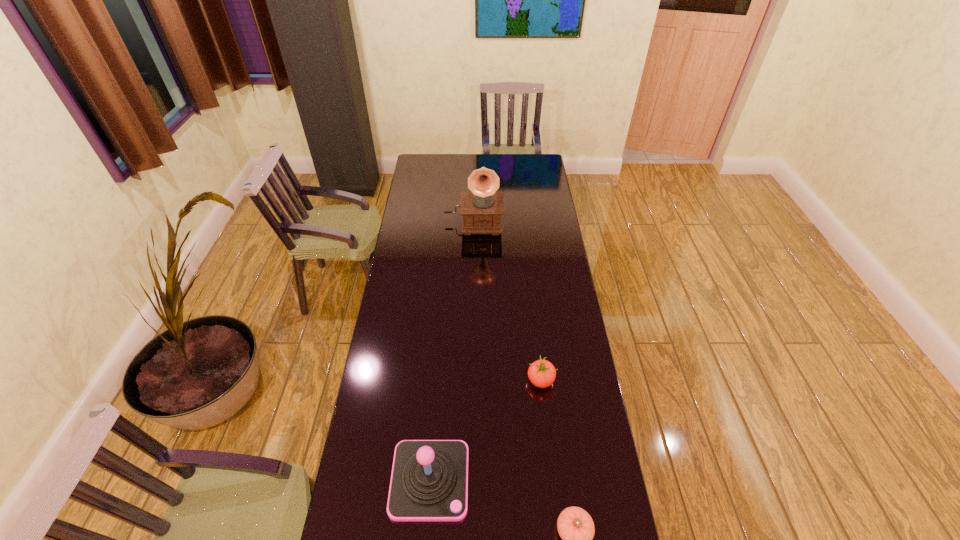
This screenshot has height=540, width=960. Find the location of `free location that satisfies the following two spatial constraints: 1. on the horn of the farther tomato; 2. on the left side of the record player`. free location that satisfies the following two spatial constraints: 1. on the horn of the farther tomato; 2. on the left side of the record player is located at coordinates (470, 381).

The height and width of the screenshot is (540, 960). Identify the location of vacant point that satisfies the following two spatial constraints: 1. on the horn of the second shortest object; 2. on the left side of the tallest object. (470, 381).

Find the location of `free space that satisfies the following two spatial constraints: 1. on the horn of the record player; 2. on the right side of the farther tomato`. free space that satisfies the following two spatial constraints: 1. on the horn of the record player; 2. on the right side of the farther tomato is located at coordinates pos(470,381).